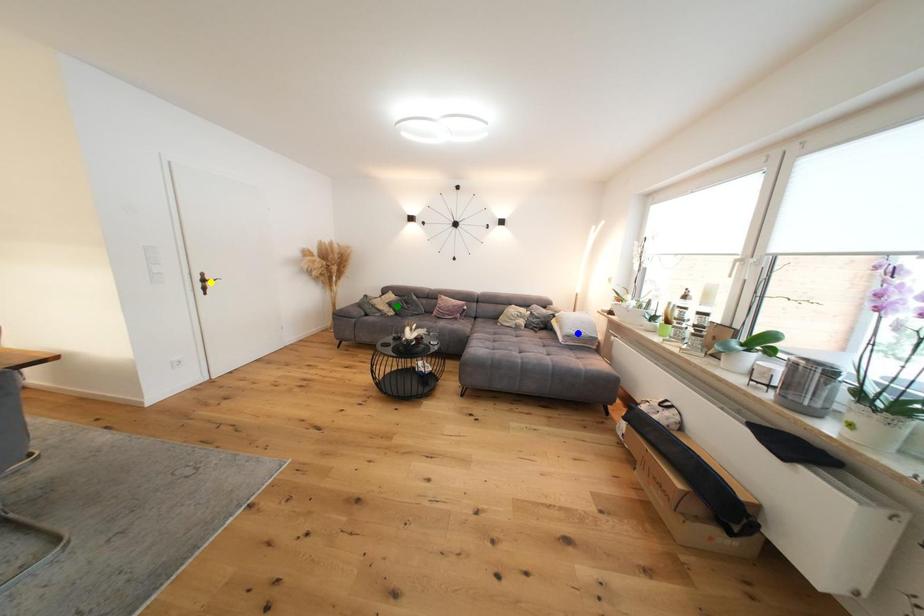
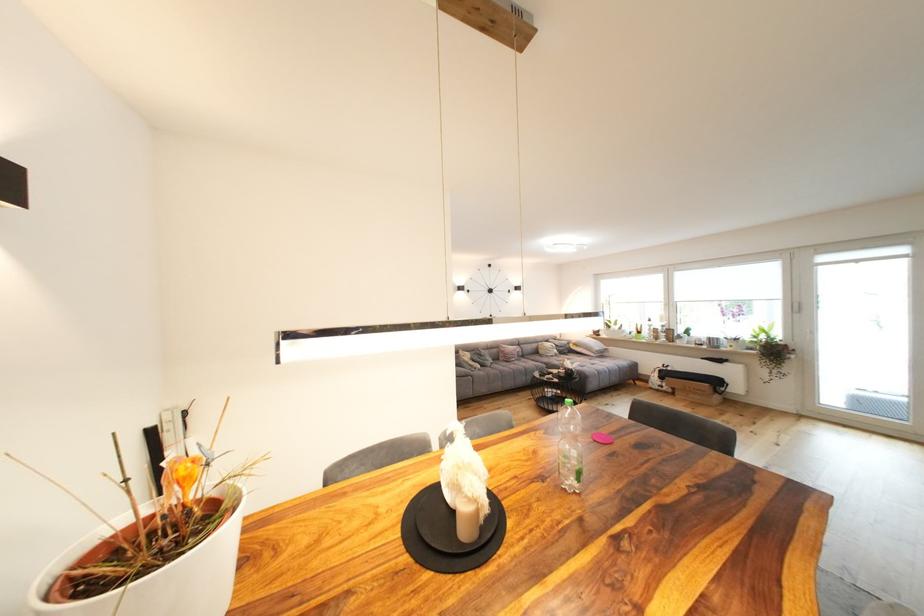
I am providing you with two images of the same scene from different viewpoints. Three points are marked in image1. Which point corresponds to a part or object that is occluded in image2?In image1, three points are marked. Which of them correspond to a part or object that is occluded in image2?Among the three points shown in image1, which one corresponds to a part or object that is no longer visible due to occlusion in image2?

yellow point